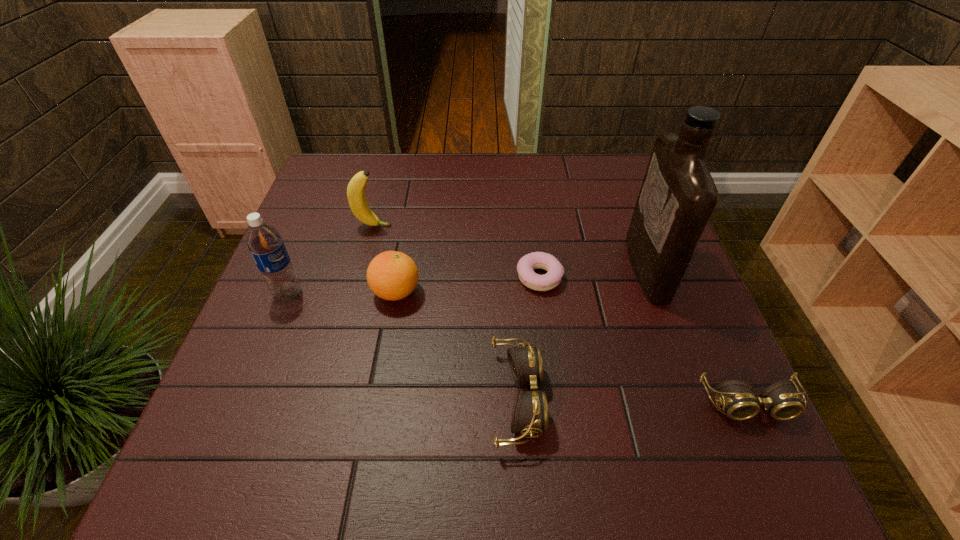
Please point out where to position a new goggles on the left to maintain spacing. Please provide its 2D coordinates. Your answer should be formatted as a tuple, i.e. [(x, y)], where the tuple contains the x and y coordinates of a point satisfying the conditions above.

[(291, 395)]